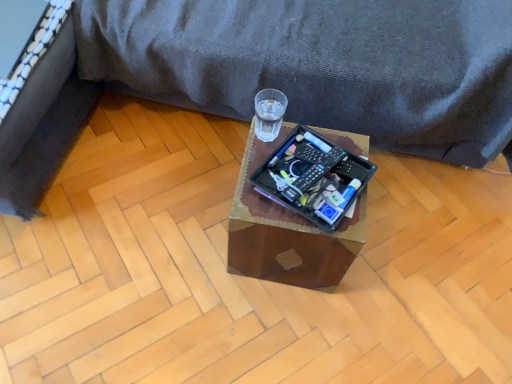
Describe the element at coordinates (287, 232) in the screenshot. I see `wooden tray at center` at that location.

The width and height of the screenshot is (512, 384). What do you see at coordinates (314, 173) in the screenshot?
I see `black plastic remote control at center` at bounding box center [314, 173].

The height and width of the screenshot is (384, 512). What are the coordinates of `black fabric bed frame at left` in the screenshot? It's located at (37, 99).

This screenshot has width=512, height=384. What do you see at coordinates (291, 73) in the screenshot?
I see `transparent glass at center` at bounding box center [291, 73].

Locate an element on the screen. wooden tray at center is located at coordinates 287,232.

Does black fabric bed frame at left have a greater width compared to transparent glass at center?

Yes.

From a real-world perspective, is black fabric bed frame at left physically above transparent glass at center?

No, from a real-world perspective, black fabric bed frame at left is not over transparent glass at center

Who is smaller, black fabric bed frame at left or transparent glass at center?

Smaller between the two is transparent glass at center.

Based on the photo, does black fabric bed frame at left come in front of transparent glass at center?

Yes, it is in front of transparent glass at center.

Is transparent glass at center completely or partially outside of black plastic remote control at center?

Yes, transparent glass at center is located beyond the bounds of black plastic remote control at center.

Is transparent glass at center facing away from black plastic remote control at center?

Correct, transparent glass at center is looking away from black plastic remote control at center.

From the image's perspective, between transparent glass at center and black plastic remote control at center, who is located below?

black plastic remote control at center appears lower in the image.

Can you see transparent glass at center touching black plastic remote control at center?

transparent glass at center and black plastic remote control at center are not in contact.

Is transparent glass at center further to camera compared to black fabric bed frame at left?

That is True.

Is black fabric bed frame at left surrounded by transparent glass at center?

No, black fabric bed frame at left is not surrounded by transparent glass at center.

Are transparent glass at center and black fabric bed frame at left making contact?

No, transparent glass at center is not making contact with black fabric bed frame at left.

Looking at the image, does transparent glass at center seem bigger or smaller compared to black fabric bed frame at left?

Considering their sizes, transparent glass at center takes up less space than black fabric bed frame at left.

From the image's perspective, which object appears higher, transparent glass at center or wooden tray at center?

transparent glass at center is shown above in the image.

Between transparent glass at center and wooden tray at center, which one has larger width?

transparent glass at center.

Is transparent glass at center far away from wooden tray at center?

They are positioned close to each other.

Is transparent glass at center outside of wooden tray at center?

Indeed, transparent glass at center is completely outside wooden tray at center.

From a real-world perspective, is black plastic remote control at center beneath black fabric bed frame at left?

No.

Can you confirm if black plastic remote control at center is wider than black fabric bed frame at left?

In fact, black plastic remote control at center might be narrower than black fabric bed frame at left.

From the image's perspective, which object appears higher, black plastic remote control at center or black fabric bed frame at left?

black fabric bed frame at left is shown above in the image.

In the image, is black fabric bed frame at left on the left side or the right side of transparent glass at center?

Based on their positions, black fabric bed frame at left is located to the left of transparent glass at center.

From the image's perspective, which one is positioned higher, black fabric bed frame at left or transparent glass at center?

transparent glass at center, from the image's perspective.

Which point is more distant from viewer, (97, 88) or (426, 53)?

The point (97, 88) is behind.

From a real-world perspective, is black fabric bed frame at left under transparent glass at center?

Yes.

Which of these two, wooden tray at center or transparent glass at center, is bigger?

Bigger between the two is transparent glass at center.

In the scene shown: Is wooden tray at center at the right side of transparent glass at center?

No, wooden tray at center is not to the right of transparent glass at center.

Is wooden tray at center situated inside transparent glass at center or outside?

wooden tray at center is located beyond the bounds of transparent glass at center.

You are a GUI agent. You are given a task and a screenshot of the screen. Output one action in this format:
    pyautogui.click(x=<x>, y=<y>)
    Task: Click on the bed frame lying above the transparent glass at center (from the image's perspective)
    This screenshot has width=512, height=384.
    Given the screenshot: What is the action you would take?
    pyautogui.click(x=37, y=99)

You are a GUI agent. You are given a task and a screenshot of the screen. Output one action in this format:
    pyautogui.click(x=<x>, y=<y>)
    Task: Click on the furniture below the black plastic remote control at center (from a real-world perspective)
    The image size is (512, 384).
    Given the screenshot: What is the action you would take?
    pyautogui.click(x=291, y=73)

Looking at the image, which one is located further to black fabric bed frame at left, wooden tray at center or transparent glass at center?

wooden tray at center.

Estimate the real-world distances between objects in this image. Which object is closer to black fabric bed frame at left, transparent glass at center or wooden tray at center?

transparent glass at center.

Estimate the real-world distances between objects in this image. Which object is closer to transparent glass at center, black plastic remote control at center or black fabric bed frame at left?

Among the two, black plastic remote control at center is located nearer to transparent glass at center.

Looking at the image, which one is located further to black plastic remote control at center, black fabric bed frame at left or transparent glass at center?

Based on the image, black fabric bed frame at left appears to be further to black plastic remote control at center.

Based on their spatial positions, is wooden tray at center or transparent glass at center further from transparent glass at center?

The object further to transparent glass at center is transparent glass at center.

Looking at the image, which one is located closer to black plastic remote control at center, transparent glass at center or wooden tray at center?

wooden tray at center.

Looking at the image, which one is located further to wooden tray at center, black plastic remote control at center or transparent glass at center?

transparent glass at center is positioned further to the anchor wooden tray at center.

Estimate the real-world distances between objects in this image. Which object is further from black plastic remote control at center, transparent glass at center or transparent glass at center?

Among the two, transparent glass at center is located further to black plastic remote control at center.

This screenshot has width=512, height=384. Find the location of `gadget between transparent glass at center and wooden tray at center vertically`. gadget between transparent glass at center and wooden tray at center vertically is located at coordinates (314, 173).

At what (x,y) coordinates should I click in order to perform the action: click on gadget between transparent glass at center and wooden tray at center from top to bottom. Please return your answer as a coordinate pair (x, y). Looking at the image, I should click on (314, 173).

Locate an element on the screen. The height and width of the screenshot is (384, 512). beverage between transparent glass at center and black plastic remote control at center in the up-down direction is located at coordinates (268, 118).

You are a GUI agent. You are given a task and a screenshot of the screen. Output one action in this format:
    pyautogui.click(x=<x>, y=<y>)
    Task: Click on the beverage between black fabric bed frame at left and transparent glass at center in the horizontal direction
    Image resolution: width=512 pixels, height=384 pixels.
    Given the screenshot: What is the action you would take?
    pyautogui.click(x=268, y=118)